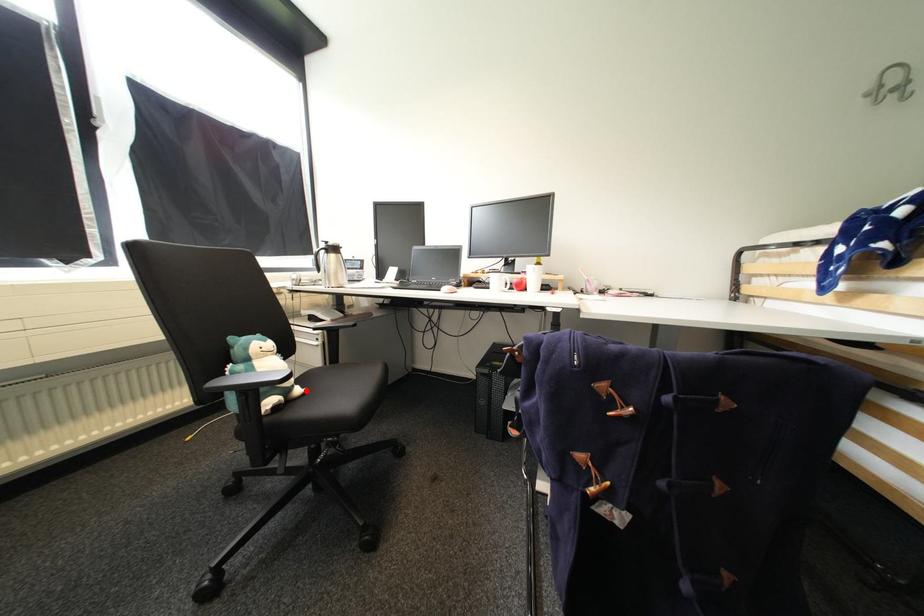
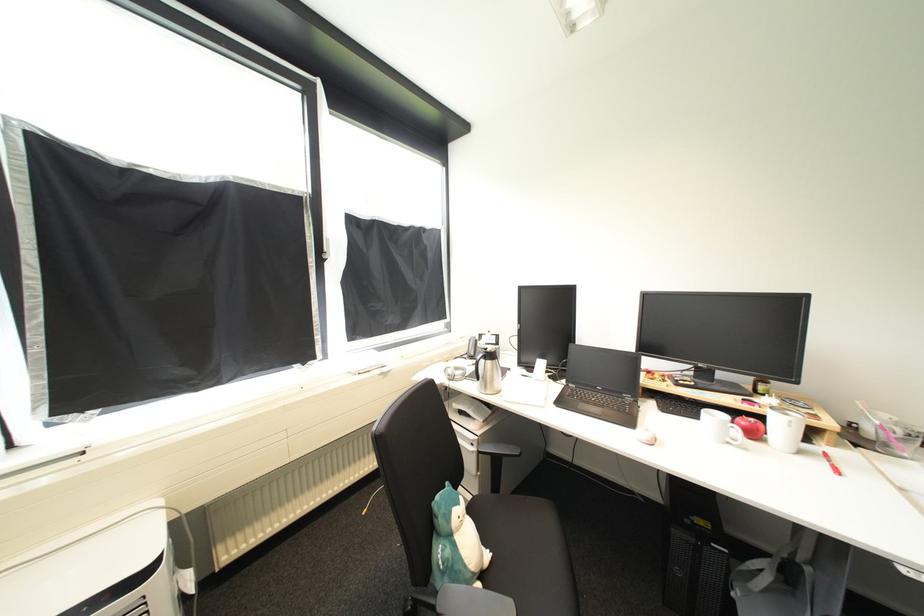
Question: A red point is marked in image1. In image2, is the corresponding 3D point closer to the camera or farther? Reply with the corresponding letter.

Choices:
 (A) The corresponding 3D point is closer.
 (B) The corresponding 3D point is farther.

Answer: (B)